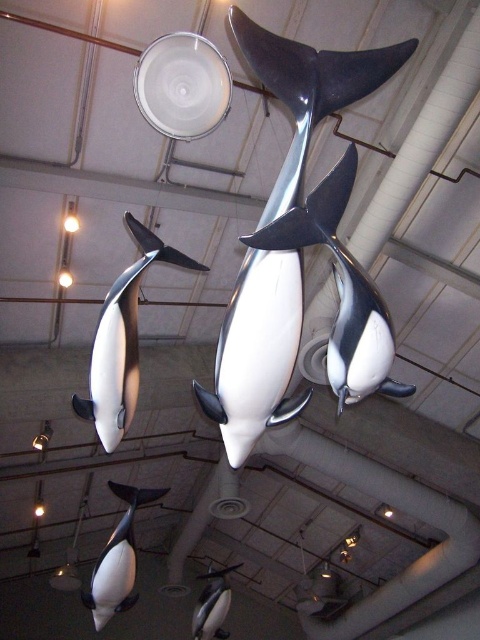
You are an art curator planning to install a new sculpture in the exhibition hall. You have a limited height restriction of 2 meters. You see the shiny metallic whale at center and the white glossy whale at lower left. Which whale sculpture can you safely install without exceeding the height limit?

The shiny metallic whale at center is not as tall as the white glossy whale at lower left. Since the height restriction is 2 meters, you should install the shiny metallic whale at center because it is shorter and less likely to exceed the limit.

You are an art curator planning to move the black and white dolphin at left and the white glossy whale at lower left to a new gallery. The new space has limited floor area. Which sculpture would require less space to display?

The black and white dolphin at left requires less space to display than the white glossy whale at lower left because it occupies less space.

You are standing in the museum and want to take a photo of the black and white dolphin at center. If your camera can focus on objects up to 1.5 meters away, will it be able to capture a clear image of the dolphin?

The distance between you and the black and white dolphin at center is 1.35 meters, which is within the camera focus range of up to 1.5 meters. Therefore, the camera can capture a clear image of the dolphin.